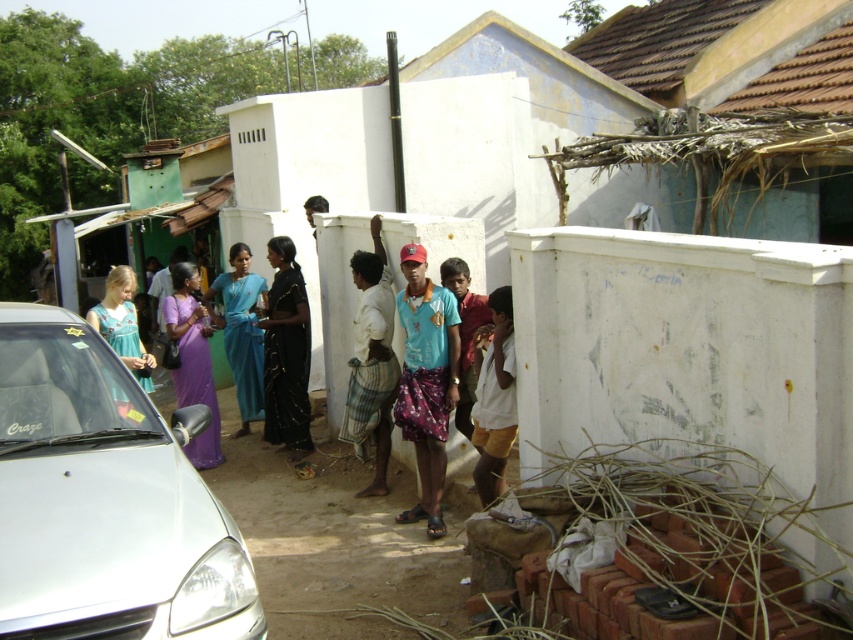
Question: Does matte blue shirt at center have a larger size compared to light blue fabric dress at center?

Choices:
 (A) yes
 (B) no

Answer: (A)

Question: Considering the real-world distances, which object is closest to the purple satin saree at center?

Choices:
 (A) white cotton shirt at center
 (B) matte blue shirt at center
 (C) black silk saree at center
 (D) light blue fabric dress at center

Answer: (D)

Question: Which point appears closest to the camera in this image?

Choices:
 (A) click(440, 326)
 (B) click(143, 364)
 (C) click(288, 397)

Answer: (A)

Question: Does black silk saree at center have a lesser width compared to white cotton shirt at center?

Choices:
 (A) no
 (B) yes

Answer: (A)

Question: Can you confirm if white glossy car at left is positioned to the left of white cotton shirt at center?

Choices:
 (A) yes
 (B) no

Answer: (A)

Question: Which object is the farthest from the matte blue shirt at center?

Choices:
 (A) white cotton shirt at center
 (B) white glossy car at left
 (C) black silk saree at center

Answer: (B)